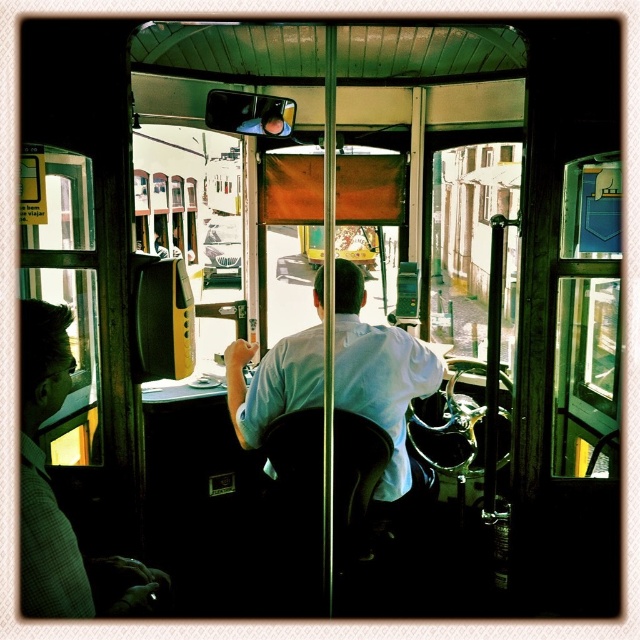
Question: Can you confirm if white shirt at center is bigger than matte black coach at left?

Choices:
 (A) no
 (B) yes

Answer: (B)

Question: Among these objects, which one is farthest from the camera?

Choices:
 (A) matte black coach at left
 (B) white shirt at center

Answer: (B)

Question: Which point is farther to the camera?

Choices:
 (A) (58, 568)
 (B) (317, 310)

Answer: (B)

Question: Can you confirm if white shirt at center is thinner than matte black coach at left?

Choices:
 (A) no
 (B) yes

Answer: (A)

Question: Does white shirt at center appear over matte black coach at left?

Choices:
 (A) yes
 (B) no

Answer: (A)